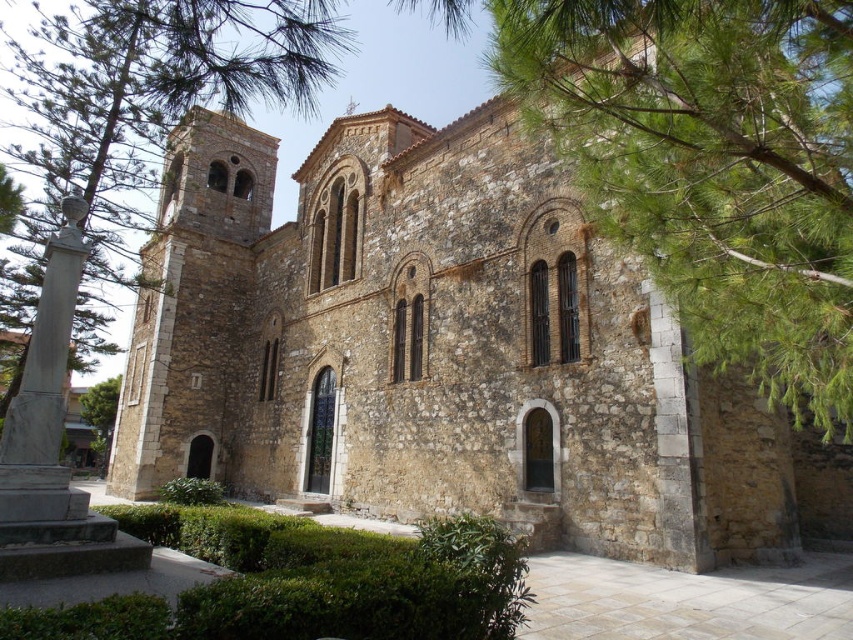
Between brown stone church at center and green leafy tree at upper left, which one is positioned lower?

brown stone church at center is below.

I want to click on brown stone church at center, so click(x=442, y=353).

Find the location of a particular element. brown stone church at center is located at coordinates (442, 353).

Is brown stone church at center bigger than green leafy tree at upper right?

Correct, brown stone church at center is larger in size than green leafy tree at upper right.

Who is positioned more to the right, brown stone church at center or green leafy tree at upper right?

green leafy tree at upper right

What do you see at coordinates (442, 353) in the screenshot?
I see `brown stone church at center` at bounding box center [442, 353].

Locate an element on the screen. The width and height of the screenshot is (853, 640). brown stone church at center is located at coordinates tap(442, 353).

Is green leafy tree at upper right positioned before green leafy tree at upper left?

Yes, green leafy tree at upper right is in front of green leafy tree at upper left.

Does green leafy tree at upper right have a lesser height compared to green leafy tree at upper left?

Yes, green leafy tree at upper right is shorter than green leafy tree at upper left.

Locate an element on the screen. Image resolution: width=853 pixels, height=640 pixels. green leafy tree at upper right is located at coordinates (712, 166).

The width and height of the screenshot is (853, 640). Find the location of `green leafy tree at upper right`. green leafy tree at upper right is located at coordinates (712, 166).